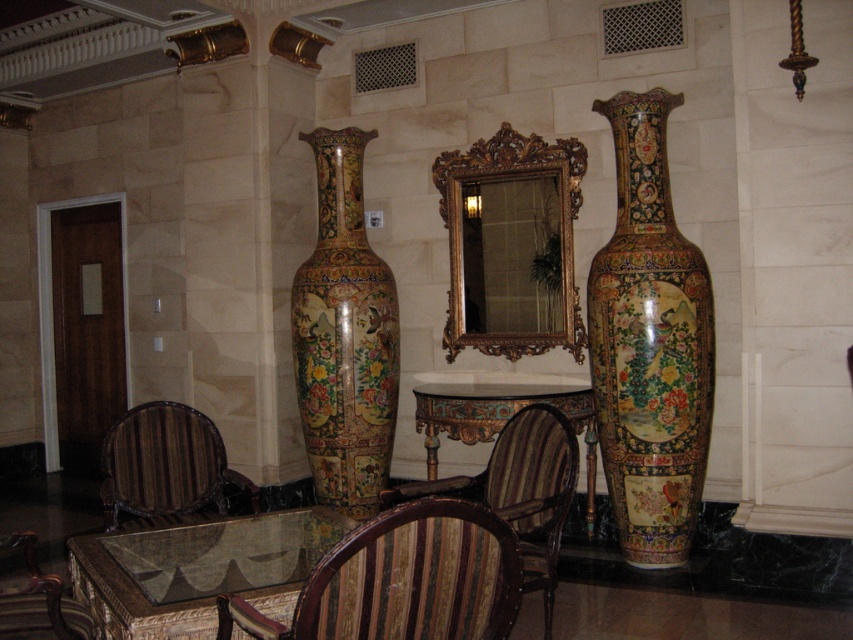
Which is below, painted ceramic vase at center or wooden polished chair at lower left?

wooden polished chair at lower left is lower down.

Does painted ceramic vase at center appear on the left side of wooden polished chair at lower left?

Incorrect, painted ceramic vase at center is not on the left side of wooden polished chair at lower left.

Between point (360, 337) and point (0, 580), which one is positioned in front?

Point (0, 580) is in front.

This screenshot has height=640, width=853. I want to click on painted ceramic vase at center, so click(344, 337).

Which is more to the left, wooden chair at center or wooden polished chair at lower left?

wooden polished chair at lower left

Between point (491, 547) and point (62, 620), which one is positioned behind?

Point (62, 620)

Between point (471, 512) and point (44, 604), which one is positioned in front?

Point (471, 512) is in front.

Where is `wooden chair at center`? wooden chair at center is located at coordinates (403, 580).

Is glass polished wood table at center below carved wood table at center?

Yes.

Between point (204, 636) and point (585, 433), which one is positioned behind?

Point (585, 433)

Where is `glass polished wood table at center`? Image resolution: width=853 pixels, height=640 pixels. glass polished wood table at center is located at coordinates 199,570.

This screenshot has width=853, height=640. Identify the location of glass polished wood table at center. (199, 570).